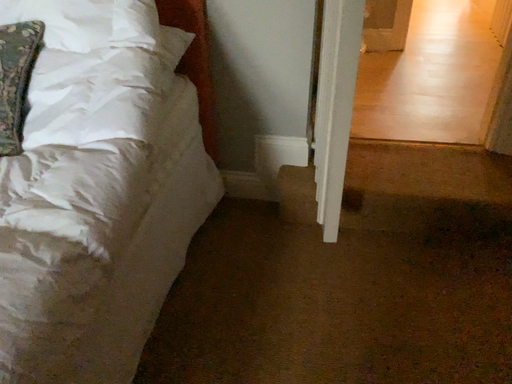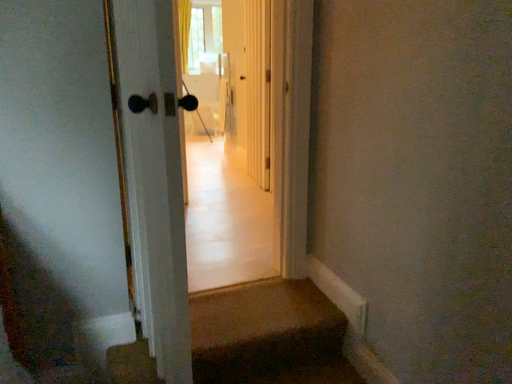
Question: How did the camera likely rotate when shooting the video?

Choices:
 (A) rotated left
 (B) rotated right

Answer: (B)